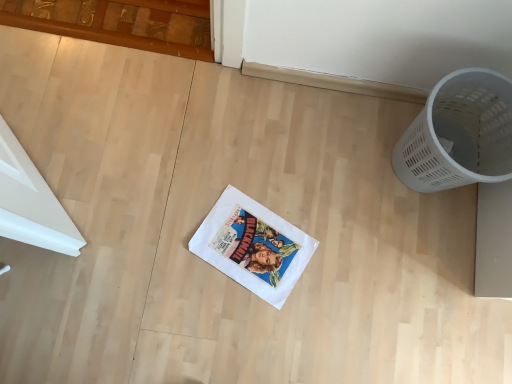
I want to click on vacant space to the right of white paper comic book at center, so click(x=337, y=276).